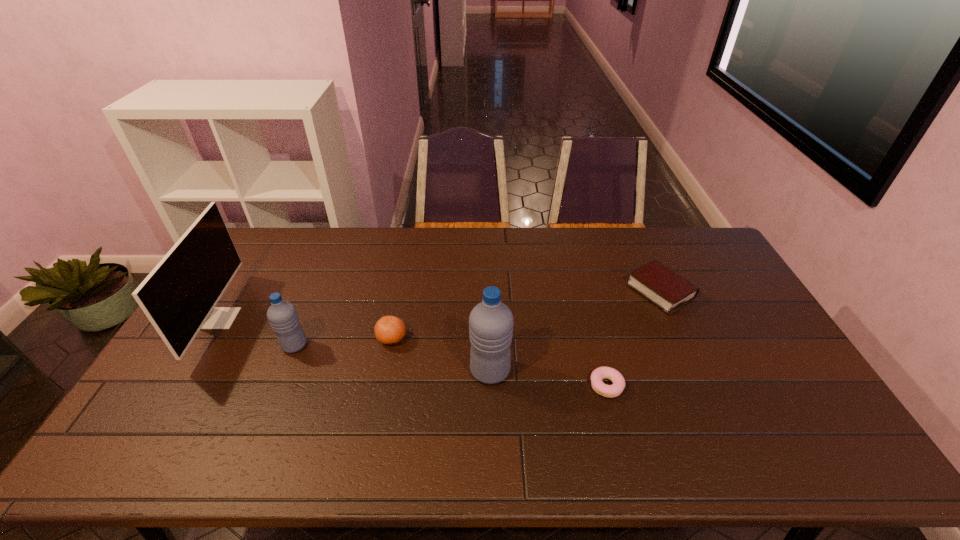
Identify the location of free point that keeps the water bottles evenly spaced on the right. (708, 400).